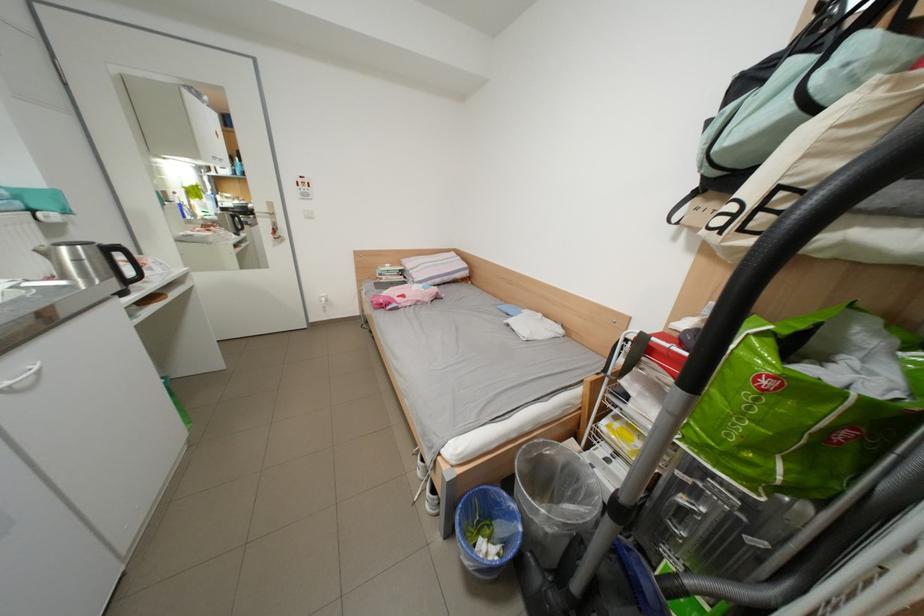
What are the coordinates of `blue plastic bin` in the screenshot? It's located at point(487,531).